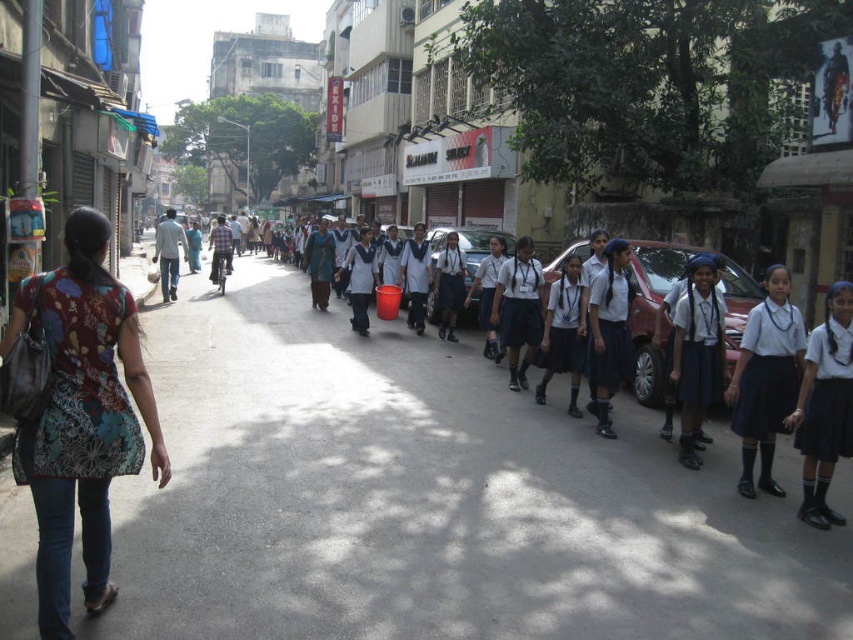
Can you confirm if white uniform students at center is positioned above printed fabric shirt at left?

Yes.

Which is in front, point (602, 497) or point (91, 378)?

Point (91, 378) is in front.

Which is behind, point (257, 477) or point (109, 561)?

The point (257, 477) is more distant.

This screenshot has width=853, height=640. What are the coordinates of `white uniform students at center` in the screenshot? It's located at (430, 499).

Who is positioned more to the left, white fabric uniform at right or blue fabric dress at center?

blue fabric dress at center is more to the left.

Is white fabric uniform at right above blue fabric dress at center?

Actually, white fabric uniform at right is below blue fabric dress at center.

Is point (766, 381) more distant than point (332, 257)?

No, (766, 381) is closer to viewer.

Where is `white fabric uniform at right`? The width and height of the screenshot is (853, 640). white fabric uniform at right is located at coordinates (764, 380).

Is white fabric uniform at right further to the viewer compared to white glossy uniform at center?

Yes, it is behind white glossy uniform at center.

Can you confirm if white fabric uniform at right is positioned below white glossy uniform at center?

No, white fabric uniform at right is not below white glossy uniform at center.

Who is more forward, (788, 401) or (805, 424)?

Result: Point (805, 424)

At what (x,y) coordinates should I click in order to perform the action: click on white fabric uniform at right. Please return your answer as a coordinate pair (x, y). This screenshot has height=640, width=853. Looking at the image, I should click on coord(764,380).